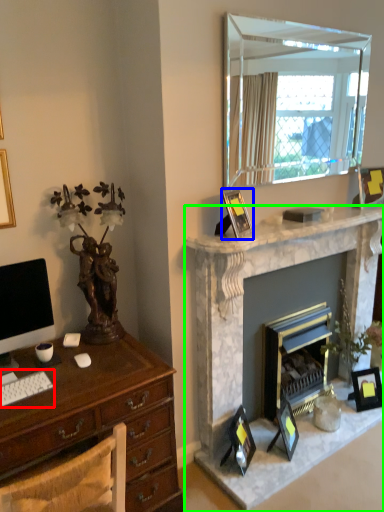
Question: Which object is the farthest from computer keyboard (highlighted by a red box)? Choose among these: picture frame (highlighted by a blue box) or fireplace (highlighted by a green box).

Choices:
 (A) picture frame
 (B) fireplace

Answer: (B)